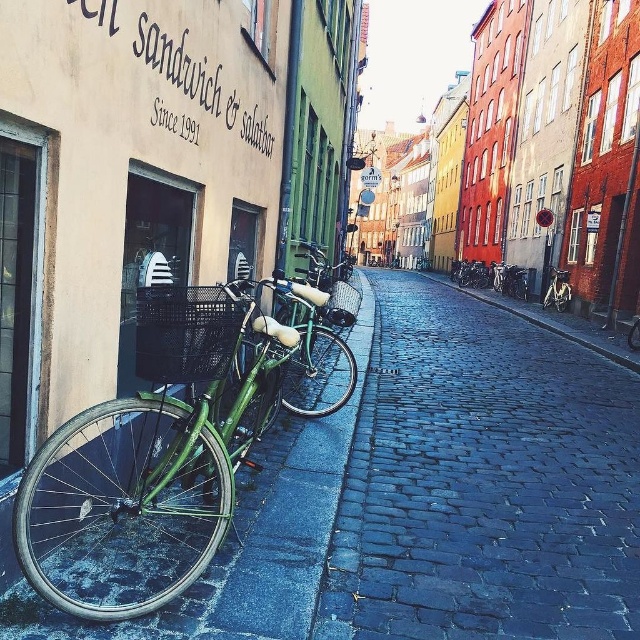
How much distance is there between green matte bicycle at left and green matte bicycle at center?

green matte bicycle at left is 13.19 meters from green matte bicycle at center.

What do you see at coordinates (147, 490) in the screenshot? I see `green matte bicycle at left` at bounding box center [147, 490].

Identify the location of green matte bicycle at left. Image resolution: width=640 pixels, height=640 pixels. (147, 490).

Is point (531, 500) behind point (566, 278)?

No, (531, 500) is closer to viewer.

Does cobblestone pavement at center appear on the right side of green matte bicycle at center?

In fact, cobblestone pavement at center is to the left of green matte bicycle at center.

Between point (515, 486) and point (561, 292), which one is positioned in front?

Point (515, 486)

Where is `cobblestone pavement at center`? The width and height of the screenshot is (640, 640). cobblestone pavement at center is located at coordinates (483, 481).

Is cobblestone pavement at center smaller than green matte bicycle at left?

Actually, cobblestone pavement at center might be larger than green matte bicycle at left.

Which of these two, cobblestone pavement at center or green matte bicycle at left, stands shorter?

green matte bicycle at left

Locate an element on the screen. cobblestone pavement at center is located at coordinates (483, 481).